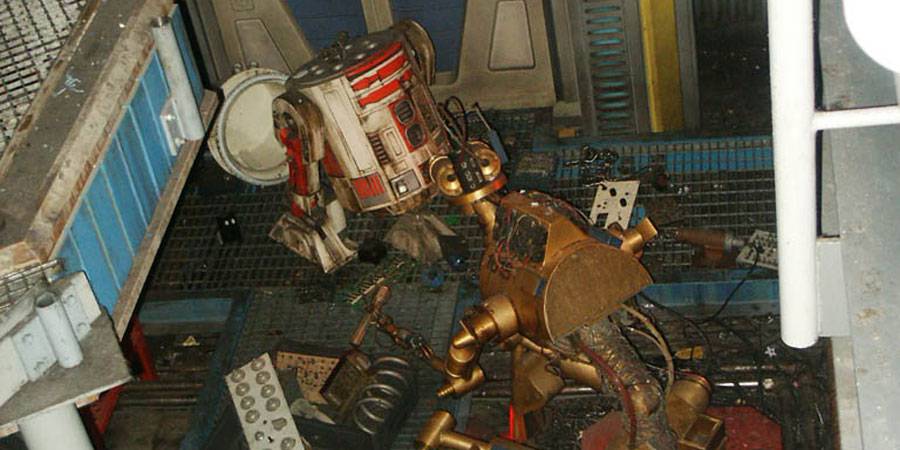
Locate an element on the screen. This screenshot has height=450, width=900. back wall is located at coordinates (292, 21), (483, 67).